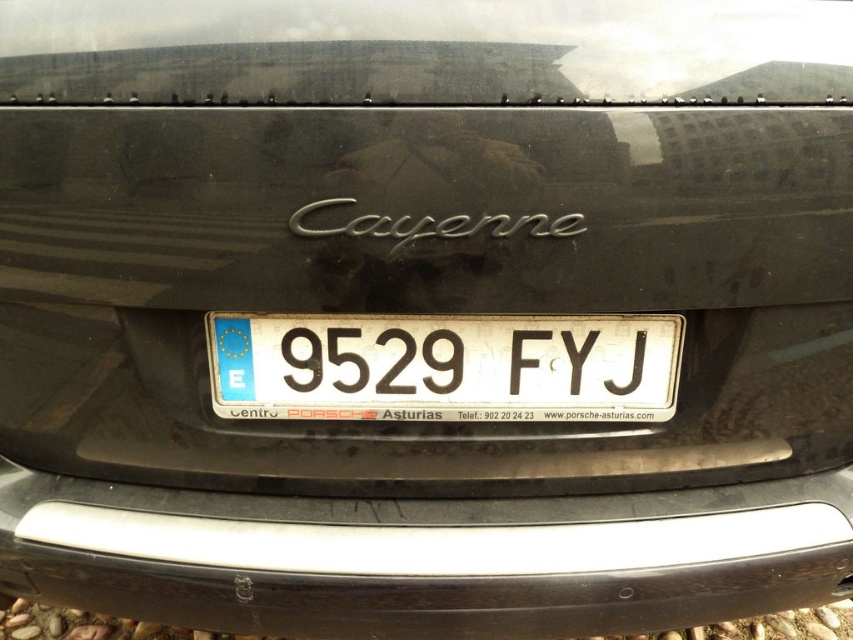
Looking at this image, is silver metallic bumper at center to the right of white plastic license plate at center from the viewer's perspective?

No, silver metallic bumper at center is not to the right of white plastic license plate at center.

Can you confirm if silver metallic bumper at center is positioned above white plastic license plate at center?

Actually, silver metallic bumper at center is below white plastic license plate at center.

What do you see at coordinates (425, 557) in the screenshot?
I see `silver metallic bumper at center` at bounding box center [425, 557].

The height and width of the screenshot is (640, 853). I want to click on silver metallic bumper at center, so click(x=425, y=557).